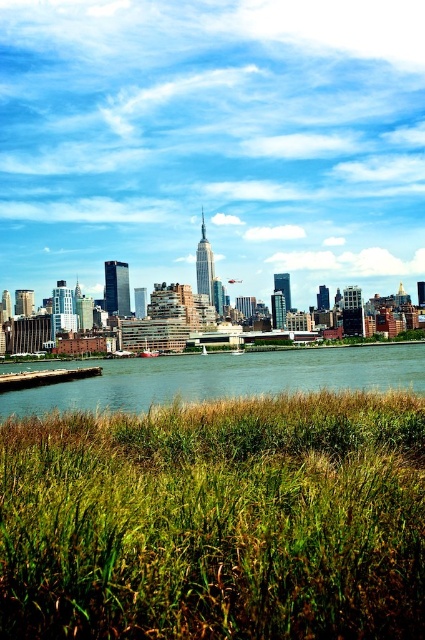
Is point (405, 241) less distant than point (139, 371)?

No, it is not.

Is point (370, 180) positioned behind point (119, 384)?

Yes, it is behind point (119, 384).

At what (x,y) coordinates should I click in order to perform the action: click on blue sky at upper center. Please return your answer as a coordinate pair (x, y). This screenshot has height=640, width=425. Looking at the image, I should click on (212, 141).

Describe the element at coordinates (217, 522) in the screenshot. I see `green grassy field at lower center` at that location.

Is point (79, 611) closer to viewer compared to point (163, 401)?

That is True.

Image resolution: width=425 pixels, height=640 pixels. I want to click on green grassy field at lower center, so click(x=217, y=522).

Which is in front, point (0, 188) or point (57, 444)?

Point (57, 444)

Is point (303, 182) behind point (272, 404)?

Yes, it is.

Locate an element on the screen. blue sky at upper center is located at coordinates (212, 141).